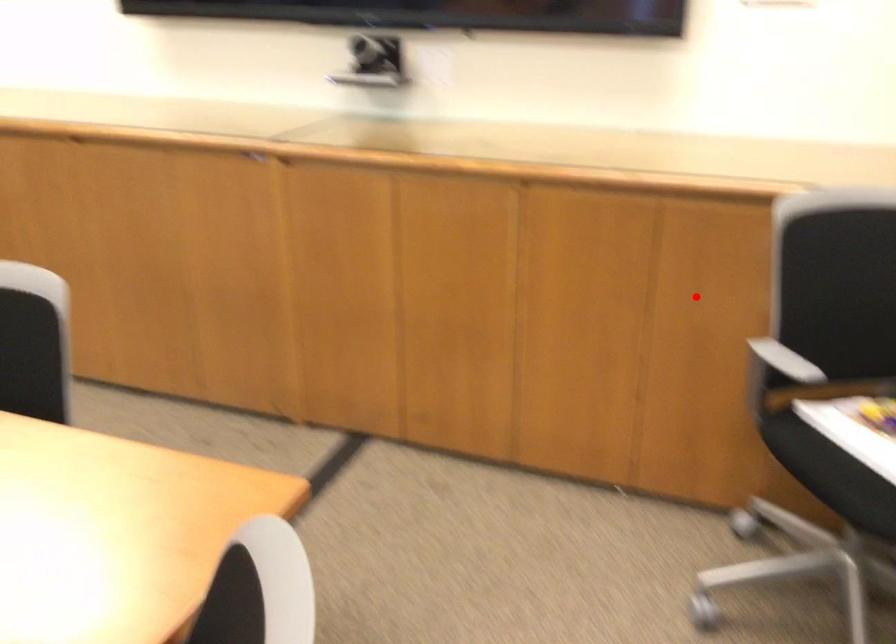
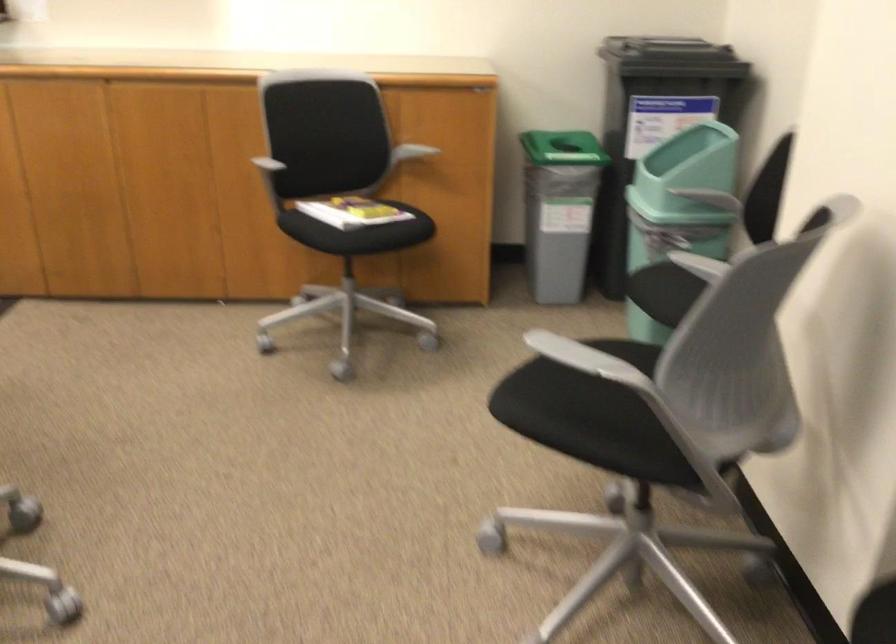
Question: I am providing you with two images of the same scene from different viewpoints. A red point is shown in image1. For the corresponding object point in image2, is it positioned nearer or farther from the camera?

Choices:
 (A) Nearer
 (B) Farther

Answer: (B)